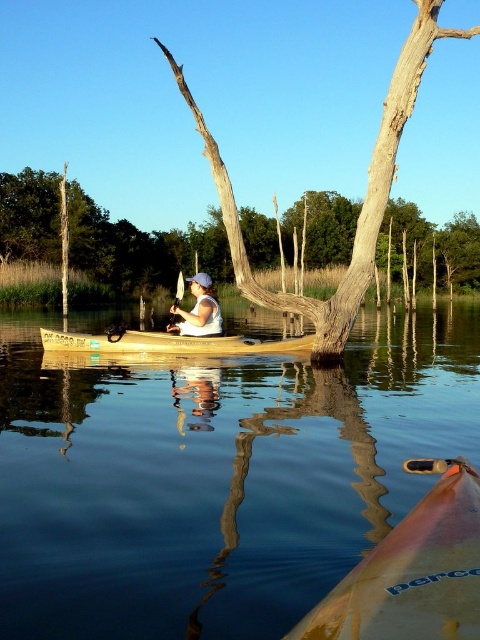
Describe the element at coordinates (142, 248) in the screenshot. This screenshot has width=480, height=640. I see `smooth bark tree at center` at that location.

Does smooth bark tree at center appear on the left side of yellow plastic kayak at lower right?

No, smooth bark tree at center is not to the left of yellow plastic kayak at lower right.

Identify the location of smooth bark tree at center. The image size is (480, 640). (142, 248).

Is smooth bark tree at center to the left of wooden canoe at center from the viewer's perspective?

In fact, smooth bark tree at center is to the right of wooden canoe at center.

Does point (136, 252) lie behind point (128, 336)?

Yes.

Locate an element on the screen. The width and height of the screenshot is (480, 640). smooth bark tree at center is located at coordinates (142, 248).

Between yellow plastic kayak at lower right and brown rough tree trunk at center, which one has more height?

brown rough tree trunk at center

Identify the location of yellow plastic kayak at lower right. Image resolution: width=480 pixels, height=640 pixels. (412, 570).

The image size is (480, 640). What are the coordinates of `yellow plastic kayak at lower right` in the screenshot? It's located at (412, 570).